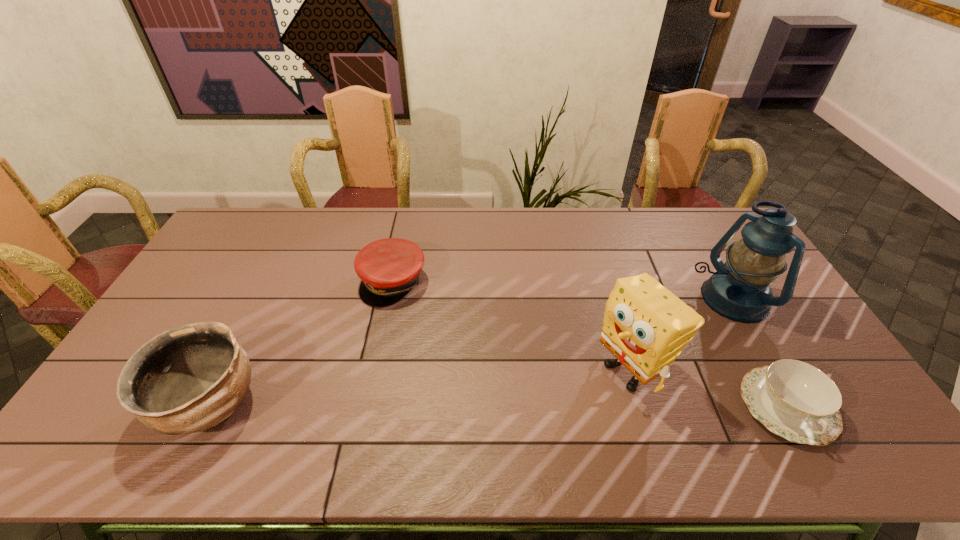
Locate an element on the screen. free space located 0.250m on the front-facing side of the second shortest object is located at coordinates (424, 368).

At what (x,y) coordinates should I click in order to perform the action: click on free spot located on the front-facing side of the second shortest object. Please return your answer as a coordinate pair (x, y). The height and width of the screenshot is (540, 960). Looking at the image, I should click on (442, 415).

Identify the location of free location located on the face of the sponge. This screenshot has height=540, width=960. (584, 399).

Locate an element on the screen. free location located on the face of the tallest object is located at coordinates (645, 346).

The width and height of the screenshot is (960, 540). Identify the location of free space located 0.060m on the face of the tallest object. (690, 320).

In order to click on free location located 0.310m on the face of the tallest object in this screenshot , I will do `click(630, 354)`.

You are a GUI agent. You are given a task and a screenshot of the screen. Output one action in this format:
    pyautogui.click(x=<x>, y=<y>)
    Task: Click on the pottery present at the near edge
    The height and width of the screenshot is (540, 960).
    Given the screenshot: What is the action you would take?
    pyautogui.click(x=187, y=379)

The height and width of the screenshot is (540, 960). I want to click on chinaware positioned at the near edge, so 795,400.

At what (x,y) coordinates should I click in order to perform the action: click on sponge that is at the near edge. Please return your answer as a coordinate pair (x, y). The height and width of the screenshot is (540, 960). Looking at the image, I should click on pyautogui.click(x=645, y=326).

Locate an element on the screen. object that is at the left edge is located at coordinates (187, 379).